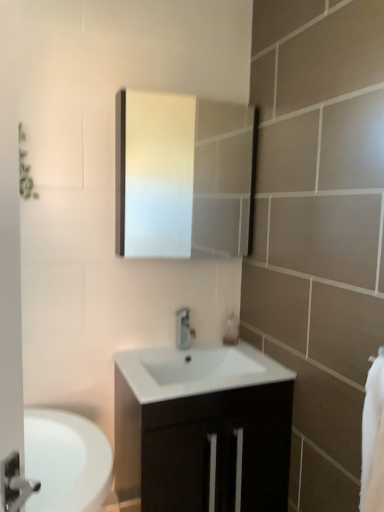
In order to face silver metallic faucet at center, should I rotate leftwards or rightwards?

You should look left and rotate roughly 0.810 degrees.

Describe the element at coordinates (371, 420) in the screenshot. I see `white soft towel at right` at that location.

This screenshot has width=384, height=512. What do you see at coordinates (231, 329) in the screenshot?
I see `translucent plastic soap dispenser at center` at bounding box center [231, 329].

Where is `white glossy cabinet at center`? This screenshot has width=384, height=512. white glossy cabinet at center is located at coordinates (202, 430).

Considering the sizes of objects translucent plastic soap dispenser at center and silver metallic faucet at center in the image provided, who is thinner, translucent plastic soap dispenser at center or silver metallic faucet at center?

Thinner between the two is translucent plastic soap dispenser at center.

Where is `tap lying in front of the translucent plastic soap dispenser at center`? This screenshot has width=384, height=512. tap lying in front of the translucent plastic soap dispenser at center is located at coordinates (184, 329).

Which object is further away from the camera taking this photo, translucent plastic soap dispenser at center or silver metallic faucet at center?

translucent plastic soap dispenser at center.

Is the surface of translucent plastic soap dispenser at center in direct contact with silver metallic faucet at center?

No, translucent plastic soap dispenser at center is not beside silver metallic faucet at center.

From the image's perspective, who appears lower, translucent plastic soap dispenser at center or white glossy cabinet at center?

white glossy cabinet at center is shown below in the image.

Locate an element on the screen. soap dispenser that is above the white glossy cabinet at center (from the image's perspective) is located at coordinates (231, 329).

Consider the image. Is translucent plastic soap dispenser at center turned away from white glossy cabinet at center?

translucent plastic soap dispenser at center is not turned away from white glossy cabinet at center.

Does white soft towel at right lie behind silver metallic faucet at center?

No, white soft towel at right is closer to the camera.

Who is smaller, white soft towel at right or silver metallic faucet at center?

Smaller between the two is silver metallic faucet at center.

Is point (362, 451) positioned in front of point (190, 327)?

Yes.

Is white soft towel at right not inside silver metallic faucet at center?

Yes, white soft towel at right is outside of silver metallic faucet at center.

Is translucent plastic soap dispenser at center further to the viewer compared to white soft towel at right?

Yes, it is.

From the image's perspective, which object appears higher, translucent plastic soap dispenser at center or white soft towel at right?

translucent plastic soap dispenser at center.

Does point (231, 324) appear closer or farther from the camera than point (375, 446)?

Clearly, point (231, 324) is more distant from the camera than point (375, 446).

How different are the orientations of translucent plastic soap dispenser at center and white soft towel at right in degrees?

89.2 degrees.

Are silver metallic faucet at center and white glossy medicine cabinet at upper center located far from each other?

Yes.

Can you confirm if silver metallic faucet at center is shorter than white glossy medicine cabinet at upper center?

Indeed, silver metallic faucet at center has a lesser height compared to white glossy medicine cabinet at upper center.

Is silver metallic faucet at center looking in the opposite direction of white glossy medicine cabinet at upper center?

No, white glossy medicine cabinet at upper center is not at the back of silver metallic faucet at center.

From a real-world perspective, between silver metallic faucet at center and white glossy medicine cabinet at upper center, who is vertically lower?

silver metallic faucet at center.

In the image, is white glossy sink at center on the left side or the right side of white soft towel at right?

In the image, white glossy sink at center appears on the left side of white soft towel at right.

Between white glossy sink at center and white soft towel at right, which one has less height?

Standing shorter between the two is white glossy sink at center.

Is white glossy sink at center positioned beyond the bounds of white soft towel at right?

white glossy sink at center lies outside white soft towel at right's area.

Is white glossy medicine cabinet at upper center wider than white soft towel at right?

Correct, the width of white glossy medicine cabinet at upper center exceeds that of white soft towel at right.

Is white glossy medicine cabinet at upper center with white soft towel at right?

There is a gap between white glossy medicine cabinet at upper center and white soft towel at right.

Looking at this image, looking at the image, does white glossy medicine cabinet at upper center seem bigger or smaller compared to white soft towel at right?

white glossy medicine cabinet at upper center is bigger than white soft towel at right.

Identify the location of soap dispenser below the silver metallic faucet at center (from the image's perspective). The height and width of the screenshot is (512, 384). (231, 329).

Where is `bathroom cabinet on the left of translucent plastic soap dispenser at center`? The image size is (384, 512). bathroom cabinet on the left of translucent plastic soap dispenser at center is located at coordinates (202, 430).

Based on the photo, estimate the real-world distances between objects in this image. Which object is closer to silver metallic faucet at center, white glossy cabinet at center or white glossy sink at center?

Among the two, white glossy sink at center is located nearer to silver metallic faucet at center.

Estimate the real-world distances between objects in this image. Which object is further from silver metallic faucet at center, translucent plastic soap dispenser at center or white glossy cabinet at center?

The object further to silver metallic faucet at center is white glossy cabinet at center.

From the picture: When comparing their distances from white glossy sink at center, does translucent plastic soap dispenser at center or white glossy cabinet at center seem closer?

Among the two, white glossy cabinet at center is located nearer to white glossy sink at center.

Considering their positions, is white glossy sink at center positioned further to white glossy cabinet at center than translucent plastic soap dispenser at center?

The object further to white glossy cabinet at center is translucent plastic soap dispenser at center.

From the picture: Looking at the image, which one is located further to white glossy medicine cabinet at upper center, white soft towel at right or white glossy cabinet at center?

white soft towel at right is further to white glossy medicine cabinet at upper center.

Which object lies further to the anchor point white glossy sink at center, silver metallic faucet at center or white glossy cabinet at center?

white glossy cabinet at center is positioned further to the anchor white glossy sink at center.

When comparing their distances from white glossy sink at center, does white soft towel at right or translucent plastic soap dispenser at center seem closer?

translucent plastic soap dispenser at center is closer to white glossy sink at center.

Which object lies nearer to the anchor point silver metallic faucet at center, white soft towel at right or white glossy medicine cabinet at upper center?

white soft towel at right lies closer to silver metallic faucet at center than the other object.

Locate an element on the screen. bath towel that lies between white glossy medicine cabinet at upper center and white glossy sink at center from top to bottom is located at coordinates (371, 420).

This screenshot has width=384, height=512. In order to click on sink between silver metallic faucet at center and white glossy cabinet at center in the vertical direction in this screenshot , I will do `click(200, 365)`.

Locate an element on the screen. sink that lies between white glossy medicine cabinet at upper center and white glossy cabinet at center from top to bottom is located at coordinates (200, 365).

This screenshot has height=512, width=384. Find the location of `soap dispenser that lies between white glossy medicine cabinet at upper center and white glossy sink at center from top to bottom`. soap dispenser that lies between white glossy medicine cabinet at upper center and white glossy sink at center from top to bottom is located at coordinates (231, 329).